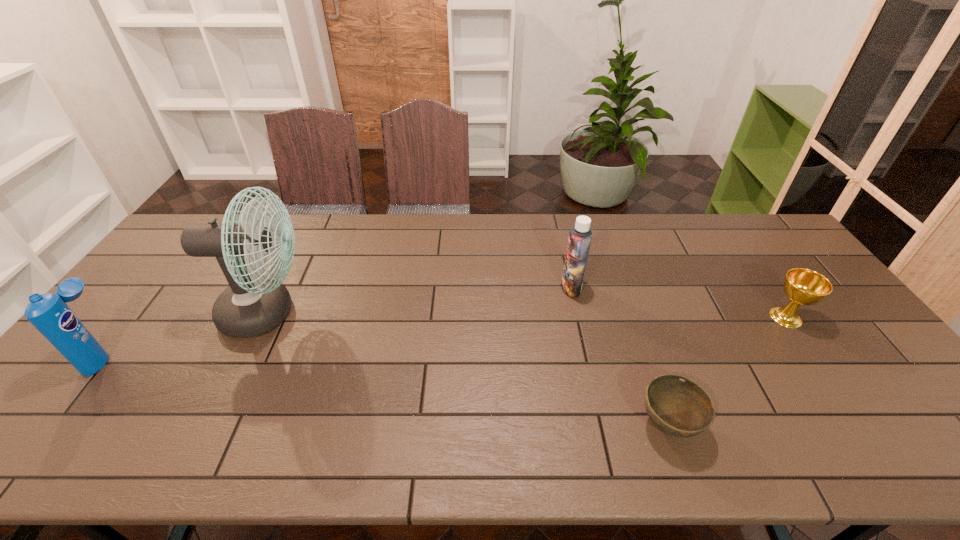
Identify the location of vacant space located 0.120m in front of the tallest object where the airflow is directed. The height and width of the screenshot is (540, 960). (354, 313).

The height and width of the screenshot is (540, 960). In order to click on free spot located 0.190m on the front label of the farther shampoo in this screenshot , I will do `click(499, 287)`.

Locate an element on the screen. vacant area situated 0.130m on the front label of the farther shampoo is located at coordinates (518, 287).

Identify the location of free space located 0.400m on the front label of the farther shampoo. The width and height of the screenshot is (960, 540). (430, 287).

The height and width of the screenshot is (540, 960). I want to click on free space located on the right of the nearer shampoo, so click(194, 355).

The width and height of the screenshot is (960, 540). What are the coordinates of `vacant area situated 0.310m on the front of the chalice` in the screenshot? It's located at (869, 436).

The image size is (960, 540). What are the coordinates of `vacant region located 0.310m on the right of the fourth object from left to right` in the screenshot? It's located at (834, 424).

The height and width of the screenshot is (540, 960). Find the location of `object located at the near edge`. object located at the near edge is located at coordinates pos(677,406).

Where is `object that is at the left edge`? Image resolution: width=960 pixels, height=540 pixels. object that is at the left edge is located at coordinates (48, 313).

This screenshot has height=540, width=960. I want to click on object at the right edge, so click(802, 286).